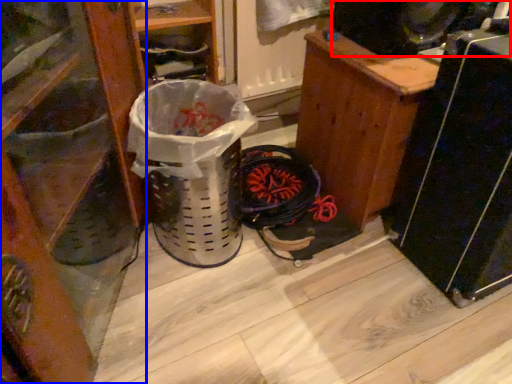
Question: Which point is closer to the camera, speaker (highlighted by a red box) or furniture (highlighted by a blue box)?

Choices:
 (A) speaker
 (B) furniture

Answer: (B)